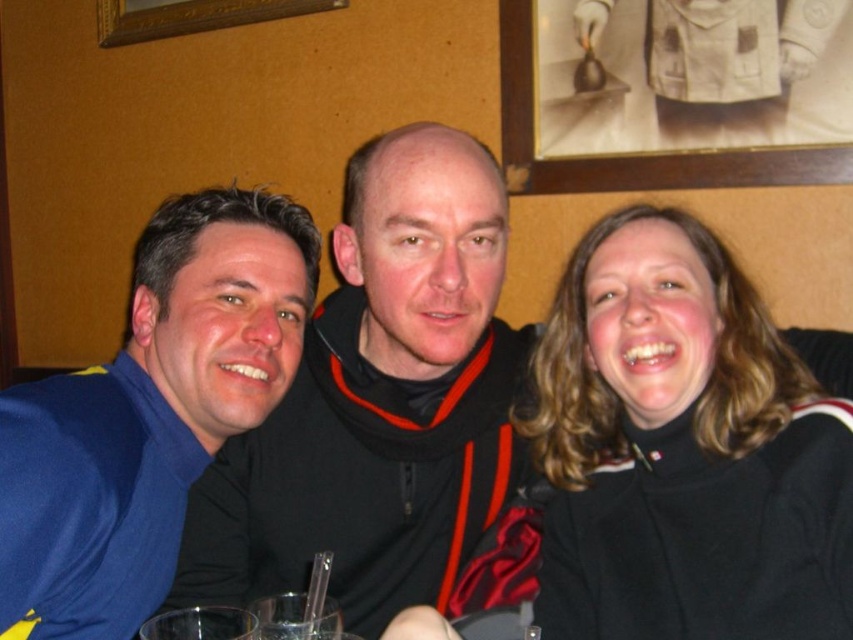
Based on the scene description, which object is positioned to the right of the other between the black turtleneck sweater at right and the black matte jacket at center?

The black turtleneck sweater at right is positioned to the right of the black matte jacket at center according to the description.

You are a photographer setting up for a group photo. You need to ensure that the black turtleneck sweater at right and the blue fabric shirt at left are visible in the frame. Based on their heights, which one might require you to adjust your camera angle to avoid being cut off?

The blue fabric shirt at left is taller than the black turtleneck sweater at right, so you might need to adjust the camera angle to ensure the taller blue fabric shirt at left is fully visible without being cut off.